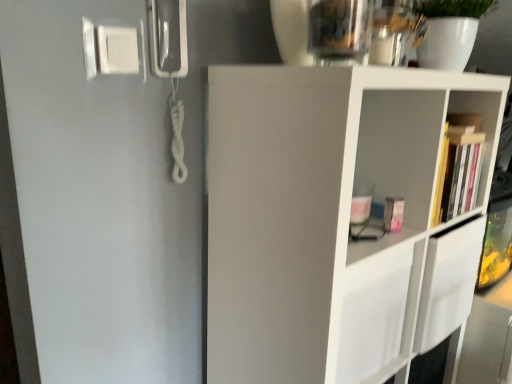
Question: Should I look upward or downward to see hardcover book at right?

Choices:
 (A) up
 (B) down

Answer: (A)

Question: Is hardcover book at right to the right of transparent glass vase at upper center from the viewer's perspective?

Choices:
 (A) yes
 (B) no

Answer: (A)

Question: Does hardcover book at right have a greater height compared to transparent glass vase at upper center?

Choices:
 (A) yes
 (B) no

Answer: (A)

Question: From the image's perspective, is hardcover book at right located beneath transparent glass vase at upper center?

Choices:
 (A) yes
 (B) no

Answer: (A)

Question: From a real-world perspective, is hardcover book at right over transparent glass vase at upper center?

Choices:
 (A) yes
 (B) no

Answer: (B)

Question: Can you confirm if hardcover book at right is wider than transparent glass vase at upper center?

Choices:
 (A) yes
 (B) no

Answer: (B)

Question: Is hardcover book at right aimed at transparent glass vase at upper center?

Choices:
 (A) yes
 (B) no

Answer: (B)

Question: Does transparent glass vase at upper center have a greater height compared to hardcover book at right?

Choices:
 (A) no
 (B) yes

Answer: (A)

Question: Does transparent glass vase at upper center turn towards hardcover book at right?

Choices:
 (A) yes
 (B) no

Answer: (B)

Question: From the image's perspective, is transparent glass vase at upper center below hardcover book at right?

Choices:
 (A) no
 (B) yes

Answer: (A)

Question: From a real-world perspective, is transparent glass vase at upper center physically above hardcover book at right?

Choices:
 (A) no
 (B) yes

Answer: (B)

Question: From a real-world perspective, is transparent glass vase at upper center physically below hardcover book at right?

Choices:
 (A) no
 (B) yes

Answer: (A)

Question: Considering the relative sizes of transparent glass vase at upper center and hardcover book at right in the image provided, is transparent glass vase at upper center shorter than hardcover book at right?

Choices:
 (A) yes
 (B) no

Answer: (A)

Question: Can you confirm if white matte shelf at center is bigger than hardcover book at right?

Choices:
 (A) yes
 (B) no

Answer: (A)